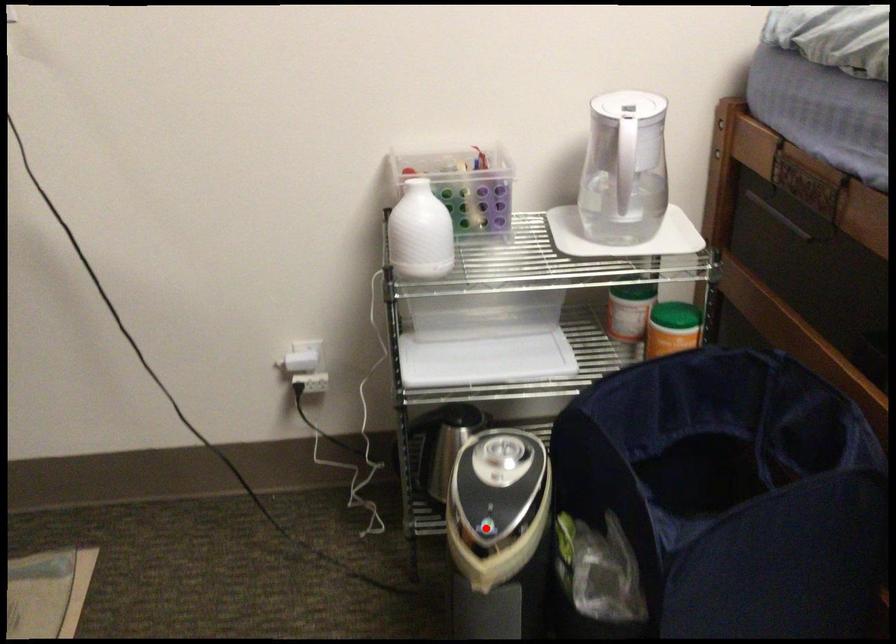
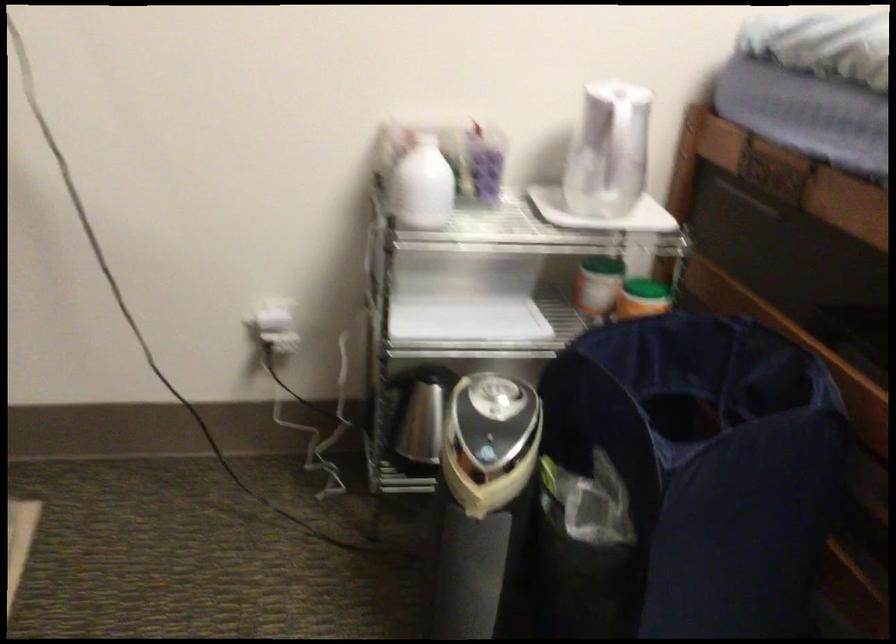
Where in the second image is the point corresponding to the highlighted location from the first image?

(486, 453)